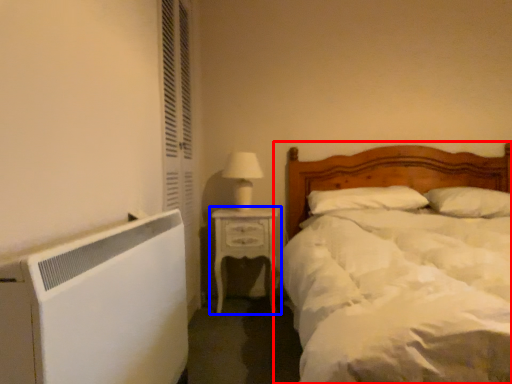
Question: Which of the following is the closest to the observer, bed (highlighted by a red box) or nightstand (highlighted by a blue box)?

Choices:
 (A) bed
 (B) nightstand

Answer: (A)